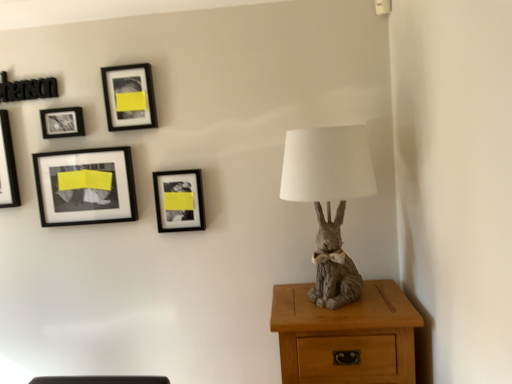
Image resolution: width=512 pixels, height=384 pixels. Describe the element at coordinates (129, 97) in the screenshot. I see `black matte picture frame at upper center, the fourth picture frame viewed from the left` at that location.

What do you see at coordinates (7, 166) in the screenshot? I see `black glossy picture frame at upper left, which is counted as the first picture frame, starting from the left` at bounding box center [7, 166].

At what (x,y) coordinates should I click in order to perform the action: click on black matte picture frame at upper left, the third picture frame positioned from the left. Please return your answer as a coordinate pair (x, y). Looking at the image, I should click on (85, 186).

Measure the distance between point (81, 199) and camera.

A distance of 1.85 meters exists between point (81, 199) and camera.

Measure the distance between matte black picture frame at upper left, which ranks as the 4th picture frame in right-to-left order, and camera.

1.82 meters.

Locate an element on the screen. This screenshot has height=384, width=512. black matte picture frame at upper center, the 2th picture frame in the right-to-left sequence is located at coordinates (129, 97).

From a real-world perspective, is matte black frame at center, the first picture frame viewed from the right, physically located above or below black matte picture frame at upper center, the fourth picture frame viewed from the left?

matte black frame at center, the first picture frame viewed from the right, is below black matte picture frame at upper center, the fourth picture frame viewed from the left.

Considering the positions of objects matte black frame at center, positioned as the fifth picture frame in left-to-right order, and black matte picture frame at upper center, the fourth picture frame viewed from the left, in the image provided, who is more to the left, matte black frame at center, positioned as the fifth picture frame in left-to-right order, or black matte picture frame at upper center, the fourth picture frame viewed from the left,?

Positioned to the left is black matte picture frame at upper center, the fourth picture frame viewed from the left.

From the image's perspective, which object appears higher, matte black frame at center, positioned as the fifth picture frame in left-to-right order, or black matte picture frame at upper center, the 2th picture frame in the right-to-left sequence?

black matte picture frame at upper center, the 2th picture frame in the right-to-left sequence, from the image's perspective.

Which is behind, point (163, 201) or point (136, 95)?

The point (163, 201) is farther.

Is gray matte rabbit at right located within matte black picture frame at upper left, placed as the 2th picture frame when sorted from left to right?

No, gray matte rabbit at right is not surrounded by matte black picture frame at upper left, placed as the 2th picture frame when sorted from left to right.

Is point (44, 127) closer or farther from the camera than point (345, 168)?

Point (44, 127) is positioned farther from the camera compared to point (345, 168).

Looking at their sizes, would you say matte black picture frame at upper left, which ranks as the 4th picture frame in right-to-left order, is wider or thinner than gray matte rabbit at right?

Considering their sizes, matte black picture frame at upper left, which ranks as the 4th picture frame in right-to-left order, looks slimmer than gray matte rabbit at right.

Can you tell me how much matte black picture frame at upper left, placed as the 2th picture frame when sorted from left to right, and gray matte rabbit at right differ in facing direction?

4.13 degrees separate the facing orientations of matte black picture frame at upper left, placed as the 2th picture frame when sorted from left to right, and gray matte rabbit at right.

Choose the correct answer: Is black glossy picture frame at upper left, the fifth picture frame positioned from the right, inside black matte picture frame at upper left, the third picture frame positioned from the left, or outside it?

black glossy picture frame at upper left, the fifth picture frame positioned from the right, is located beyond the bounds of black matte picture frame at upper left, the third picture frame positioned from the left.

From a real-world perspective, which is physically below, black glossy picture frame at upper left, the fifth picture frame positioned from the right, or black matte picture frame at upper left, the third picture frame positioned from the left?

black matte picture frame at upper left, the third picture frame positioned from the left, is physically lower.

Is black glossy picture frame at upper left, which is counted as the first picture frame, starting from the left, next to black matte picture frame at upper left, the third picture frame positioned from the left?

There is a gap between black glossy picture frame at upper left, which is counted as the first picture frame, starting from the left, and black matte picture frame at upper left, the third picture frame positioned from the left.

In the scene shown: Which point is more forward, (2,198) or (63,164)?

Positioned in front is point (63,164).

From a real-world perspective, is light brown wood nightstand at lower right above or below black glossy picture frame at upper left, the fifth picture frame positioned from the right?

light brown wood nightstand at lower right is situated lower than black glossy picture frame at upper left, the fifth picture frame positioned from the right, in the real world.

Considering the sizes of light brown wood nightstand at lower right and black glossy picture frame at upper left, the fifth picture frame positioned from the right, in the image, is light brown wood nightstand at lower right taller or shorter than black glossy picture frame at upper left, the fifth picture frame positioned from the right,?

light brown wood nightstand at lower right is taller than black glossy picture frame at upper left, the fifth picture frame positioned from the right.

Is light brown wood nightstand at lower right to the left or to the right of black glossy picture frame at upper left, which is counted as the first picture frame, starting from the left, in the image?

In the image, light brown wood nightstand at lower right appears on the right side of black glossy picture frame at upper left, which is counted as the first picture frame, starting from the left.

Looking at this image, is light brown wood nightstand at lower right bigger than black glossy picture frame at upper left, the fifth picture frame positioned from the right?

Yes.

Is black glossy picture frame at upper left, the fifth picture frame positioned from the right, bigger or smaller than black matte picture frame at upper center, the fourth picture frame viewed from the left?

Considering their sizes, black glossy picture frame at upper left, the fifth picture frame positioned from the right, takes up more space than black matte picture frame at upper center, the fourth picture frame viewed from the left.

Does point (6, 170) come farther from viewer compared to point (113, 103)?

Yes, it is.

From a real-world perspective, does black glossy picture frame at upper left, the fifth picture frame positioned from the right, sit lower than black matte picture frame at upper center, the fourth picture frame viewed from the left?

Yes.

Considering the positions of objects black glossy picture frame at upper left, which is counted as the first picture frame, starting from the left, and black matte picture frame at upper center, the fourth picture frame viewed from the left, in the image provided, who is in front, black glossy picture frame at upper left, which is counted as the first picture frame, starting from the left, or black matte picture frame at upper center, the fourth picture frame viewed from the left,?

black matte picture frame at upper center, the fourth picture frame viewed from the left, is closer to the camera.

Can you see matte black picture frame at upper left, which ranks as the 4th picture frame in right-to-left order, touching black matte picture frame at upper center, the fourth picture frame viewed from the left?

They are not placed beside each other.

From a real-world perspective, is matte black picture frame at upper left, which ranks as the 4th picture frame in right-to-left order, positioned above or below black matte picture frame at upper center, the 2th picture frame in the right-to-left sequence?

matte black picture frame at upper left, which ranks as the 4th picture frame in right-to-left order, is situated lower than black matte picture frame at upper center, the 2th picture frame in the right-to-left sequence, in the real world.

Looking at the image, does matte black picture frame at upper left, placed as the 2th picture frame when sorted from left to right, seem bigger or smaller compared to black matte picture frame at upper center, the fourth picture frame viewed from the left?

Considering their sizes, matte black picture frame at upper left, placed as the 2th picture frame when sorted from left to right, takes up less space than black matte picture frame at upper center, the fourth picture frame viewed from the left.

Is point (45, 134) closer or farther from the camera than point (139, 123)?

Clearly, point (45, 134) is more distant from the camera than point (139, 123).

Considering the points (134, 95) and (9, 163), which point is behind, point (134, 95) or point (9, 163)?

The point (9, 163) is farther from the camera.

Considering the sizes of objects black matte picture frame at upper center, the fourth picture frame viewed from the left, and black glossy picture frame at upper left, the fifth picture frame positioned from the right, in the image provided, who is wider, black matte picture frame at upper center, the fourth picture frame viewed from the left, or black glossy picture frame at upper left, the fifth picture frame positioned from the right,?

black glossy picture frame at upper left, the fifth picture frame positioned from the right.

Does black matte picture frame at upper center, the fourth picture frame viewed from the left, turn towards black glossy picture frame at upper left, which is counted as the first picture frame, starting from the left?

No, black matte picture frame at upper center, the fourth picture frame viewed from the left, does not turn towards black glossy picture frame at upper left, which is counted as the first picture frame, starting from the left.

From the image's perspective, is black matte picture frame at upper center, the 2th picture frame in the right-to-left sequence, above or below black glossy picture frame at upper left, the fifth picture frame positioned from the right?

black matte picture frame at upper center, the 2th picture frame in the right-to-left sequence, is above black glossy picture frame at upper left, the fifth picture frame positioned from the right.

The height and width of the screenshot is (384, 512). Find the location of `picture frame that is the 4th object directly below the black matte picture frame at upper center, the 2th picture frame in the right-to-left sequence (from a real-world perspective)`. picture frame that is the 4th object directly below the black matte picture frame at upper center, the 2th picture frame in the right-to-left sequence (from a real-world perspective) is located at coordinates (179, 200).

Which picture frame is the 3rd one when counting from the back of the gray matte rabbit at right? Please provide its 2D coordinates.

[(62, 122)]

Considering their positions, is light brown wood nightstand at lower right positioned closer to gray matte rabbit at right than black matte picture frame at upper center, the 2th picture frame in the right-to-left sequence?

light brown wood nightstand at lower right.

Based on the photo, when comparing their distances from black glossy picture frame at upper left, the fifth picture frame positioned from the right, does light brown wood nightstand at lower right or matte black frame at center, positioned as the fifth picture frame in left-to-right order, seem further?

The object further to black glossy picture frame at upper left, the fifth picture frame positioned from the right, is light brown wood nightstand at lower right.

Considering their positions, is black glossy picture frame at upper left, the fifth picture frame positioned from the right, positioned further to black matte picture frame at upper center, the fourth picture frame viewed from the left, than black matte picture frame at upper left, the third picture frame positioned from the left?

black glossy picture frame at upper left, the fifth picture frame positioned from the right, is positioned further to the anchor black matte picture frame at upper center, the fourth picture frame viewed from the left.

Based on their spatial positions, is light brown wood nightstand at lower right or gray matte rabbit at right further from black glossy picture frame at upper left, which is counted as the first picture frame, starting from the left?

light brown wood nightstand at lower right is further to black glossy picture frame at upper left, which is counted as the first picture frame, starting from the left.

Which object lies further to the anchor point light brown wood nightstand at lower right, matte black picture frame at upper left, which ranks as the 4th picture frame in right-to-left order, or gray matte rabbit at right?

Among the two, matte black picture frame at upper left, which ranks as the 4th picture frame in right-to-left order, is located further to light brown wood nightstand at lower right.

From the picture: When comparing their distances from light brown wood nightstand at lower right, does matte black picture frame at upper left, which ranks as the 4th picture frame in right-to-left order, or black matte picture frame at upper center, the 2th picture frame in the right-to-left sequence, seem further?

matte black picture frame at upper left, which ranks as the 4th picture frame in right-to-left order, is further to light brown wood nightstand at lower right.

Looking at this image, estimate the real-world distances between objects in this image. Which object is closer to black glossy picture frame at upper left, which is counted as the first picture frame, starting from the left, black matte picture frame at upper left, placed as the third picture frame when sorted from right to left, or gray matte rabbit at right?

Among the two, black matte picture frame at upper left, placed as the third picture frame when sorted from right to left, is located nearer to black glossy picture frame at upper left, which is counted as the first picture frame, starting from the left.

Which object lies nearer to the anchor point black matte picture frame at upper left, placed as the third picture frame when sorted from right to left, matte black picture frame at upper left, placed as the 2th picture frame when sorted from left to right, or black glossy picture frame at upper left, the fifth picture frame positioned from the right?

matte black picture frame at upper left, placed as the 2th picture frame when sorted from left to right, is positioned closer to the anchor black matte picture frame at upper left, placed as the third picture frame when sorted from right to left.

Identify the location of table lamp between black glossy picture frame at upper left, the fifth picture frame positioned from the right, and light brown wood nightstand at lower right from left to right. (329, 201).

I want to click on table lamp between matte black picture frame at upper left, which ranks as the 4th picture frame in right-to-left order, and light brown wood nightstand at lower right, in the horizontal direction, so click(329, 201).

You are a GUI agent. You are given a task and a screenshot of the screen. Output one action in this format:
    pyautogui.click(x=<x>, y=<y>)
    Task: Click on the picture frame located between black glossy picture frame at upper left, the fifth picture frame positioned from the right, and black matte picture frame at upper left, the third picture frame positioned from the left, in the left-right direction
    
    Given the screenshot: What is the action you would take?
    pyautogui.click(x=62, y=122)

The image size is (512, 384). Find the location of `picture frame between black matte picture frame at upper center, the 2th picture frame in the right-to-left sequence, and gray matte rabbit at right from left to right`. picture frame between black matte picture frame at upper center, the 2th picture frame in the right-to-left sequence, and gray matte rabbit at right from left to right is located at coordinates (179, 200).